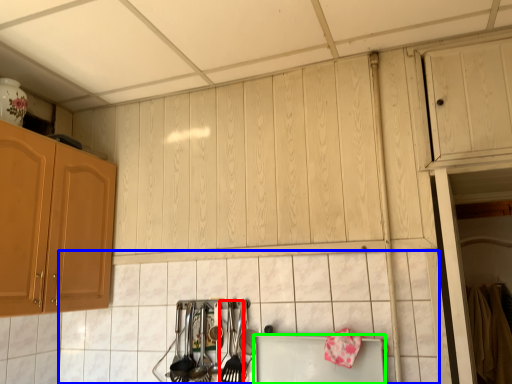
Question: Which object is the closest to the silverware (highlighted by a red box)? Choose among these: tile (highlighted by a blue box) or appliance (highlighted by a green box).

Choices:
 (A) tile
 (B) appliance

Answer: (B)